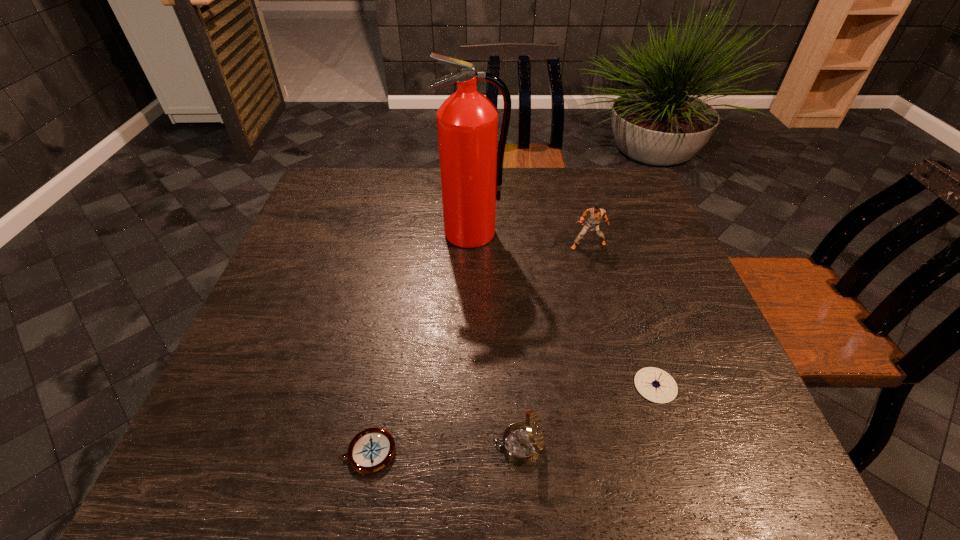
The width and height of the screenshot is (960, 540). In order to click on vacant space that is in between the tallest compass and the fire extinguisher in this screenshot , I will do `click(495, 339)`.

The width and height of the screenshot is (960, 540). I want to click on empty space between the puncher and the second tallest compass, so click(622, 315).

Locate which object ranks third in proximity to the fourth shortest object. Please provide its 2D coordinates. Your answer should be formatted as a tuple, i.e. [(x, y)], where the tuple contains the x and y coordinates of a point satisfying the conditions above.

[(521, 442)]

The image size is (960, 540). In order to click on object that stands as the closest to the fourth shortest object in this screenshot , I will do `click(471, 168)`.

Identify the location of compass that is the third nearest to the tallest object. The height and width of the screenshot is (540, 960). (371, 450).

The image size is (960, 540). What are the coordinates of `the second closest compass to the puncher` in the screenshot? It's located at (521, 442).

At what (x,y) coordinates should I click in order to perform the action: click on free spot that satisfies the following two spatial constraints: 1. on the front-facing side of the second shortest object; 2. on the left side of the fourth shortest object. Please return your answer as a coordinate pair (x, y). Image resolution: width=960 pixels, height=540 pixels. Looking at the image, I should click on (626, 386).

I want to click on vacant space that satisfies the following two spatial constraints: 1. on the front-facing side of the fourth shortest object; 2. on the right side of the third farthest object, so click(x=626, y=386).

Where is `free space that satisfies the following two spatial constraints: 1. on the front-facing side of the puncher; 2. with the dial facing the second compass from right to left`? The height and width of the screenshot is (540, 960). free space that satisfies the following two spatial constraints: 1. on the front-facing side of the puncher; 2. with the dial facing the second compass from right to left is located at coordinates (642, 444).

Locate an element on the screen. This screenshot has width=960, height=540. vacant space that satisfies the following two spatial constraints: 1. on the front side of the second shortest object; 2. with the dial facing the third tallest object is located at coordinates (675, 444).